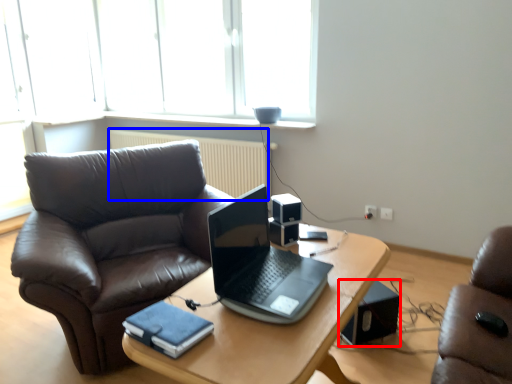
Question: Which object is further to the camera taking this photo, loudspeaker (highlighted by a red box) or radiator (highlighted by a blue box)?

Choices:
 (A) loudspeaker
 (B) radiator

Answer: (B)